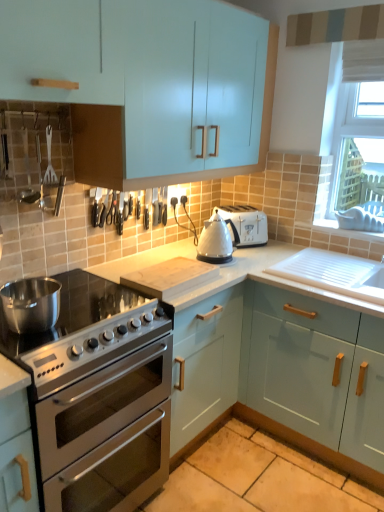
This screenshot has height=512, width=384. Identify the location of free space to the left of white glossy kettle at center, which is counted as the 1th appliance, starting from the top. (183, 257).